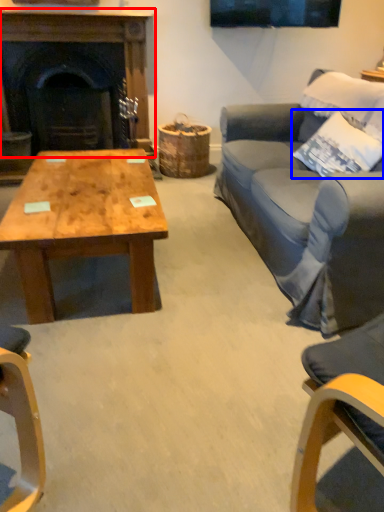
Question: Which object is closer to the camera taking this photo, fireplace (highlighted by a red box) or pillow (highlighted by a blue box)?

Choices:
 (A) fireplace
 (B) pillow

Answer: (B)